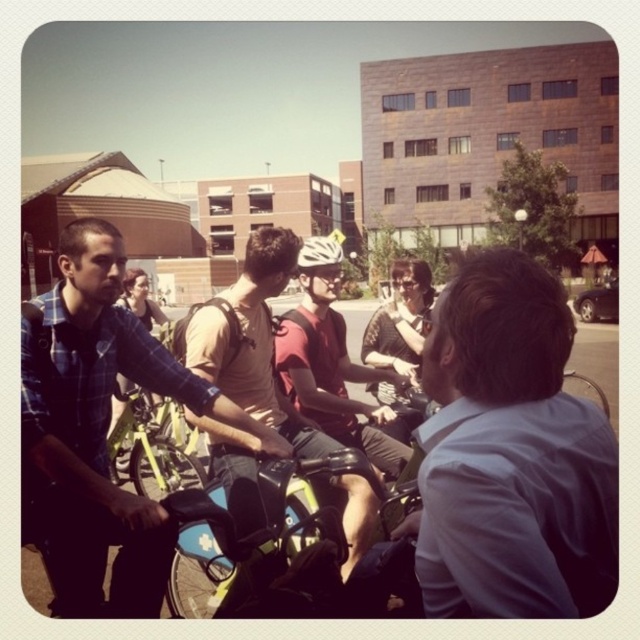
Can you confirm if plaid shirt at left is wider than matte beige shirt at center?

Indeed, plaid shirt at left has a greater width compared to matte beige shirt at center.

Where is `plaid shirt at left`? The height and width of the screenshot is (640, 640). plaid shirt at left is located at coordinates (97, 433).

The height and width of the screenshot is (640, 640). What are the coordinates of `plaid shirt at left` in the screenshot? It's located at (97, 433).

The width and height of the screenshot is (640, 640). I want to click on plaid shirt at left, so click(x=97, y=433).

Does blue matte motorcycle at center appear on the right side of matte red helmet at center?

No, blue matte motorcycle at center is not to the right of matte red helmet at center.

You are a GUI agent. You are given a task and a screenshot of the screen. Output one action in this format:
    pyautogui.click(x=<x>, y=<y>)
    Task: Click on the blue matte motorcycle at center
    This screenshot has height=640, width=640.
    Given the screenshot: What is the action you would take?
    pyautogui.click(x=292, y=550)

At what (x,y) coordinates should I click in order to perform the action: click on blue matte motorcycle at center. Please return your answer as a coordinate pair (x, y). Looking at the image, I should click on (292, 550).

Between point (339, 444) and point (296, 369), which one is positioned in front?

Point (339, 444)

Can you confirm if matte beige shirt at center is bigger than matte red helmet at center?

Incorrect, matte beige shirt at center is not larger than matte red helmet at center.

You are a GUI agent. You are given a task and a screenshot of the screen. Output one action in this format:
    pyautogui.click(x=<x>, y=<y>)
    Task: Click on the matte beige shirt at center
    
    Given the screenshot: What is the action you would take?
    pyautogui.click(x=253, y=340)

At what (x,y) coordinates should I click in order to perform the action: click on matte beige shirt at center. Please return your answer as a coordinate pair (x, y). This screenshot has height=640, width=640. Looking at the image, I should click on (253, 340).